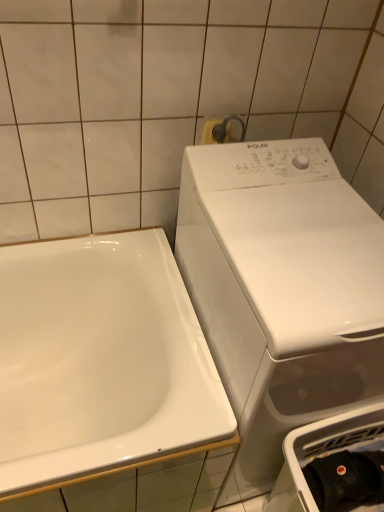
Question: Considering the positions of point (347, 373) and point (367, 451), is point (347, 373) closer or farther from the camera than point (367, 451)?

Choices:
 (A) closer
 (B) farther

Answer: (A)

Question: Is white glossy washing machine at right inside or outside of black cotton cap at lower right?

Choices:
 (A) outside
 (B) inside

Answer: (A)

Question: Estimate the real-world distances between objects in this image. Which object is farther from the white plastic dish washer at lower right?

Choices:
 (A) white glossy washing machine at right
 (B) white glossy sink at left
 (C) black cotton cap at lower right
 (D) metallic silver towel bar at upper center

Answer: (D)

Question: Estimate the real-world distances between objects in this image. Which object is farther from the white glossy washing machine at right?

Choices:
 (A) white glossy sink at left
 (B) black cotton cap at lower right
 (C) metallic silver towel bar at upper center
 (D) white plastic dish washer at lower right

Answer: (C)